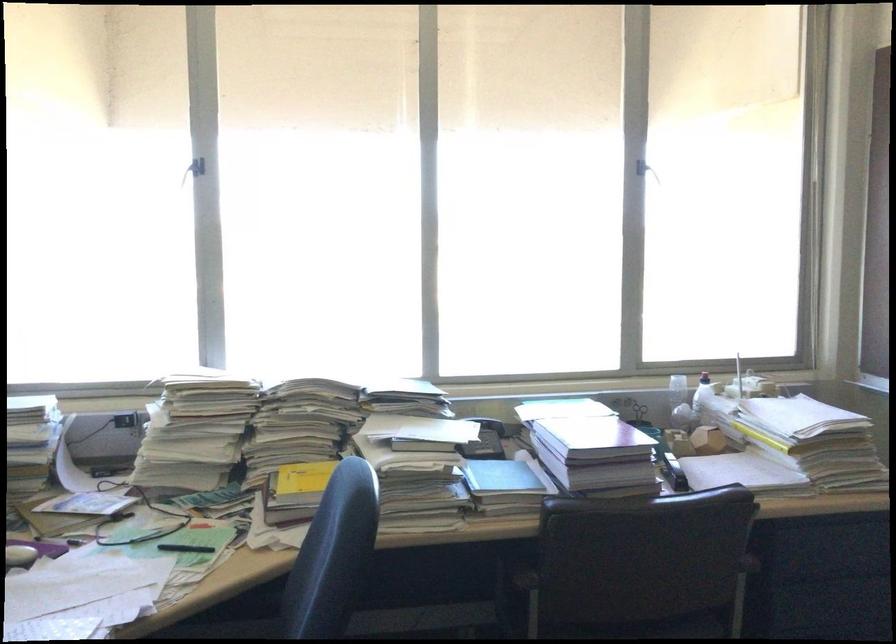
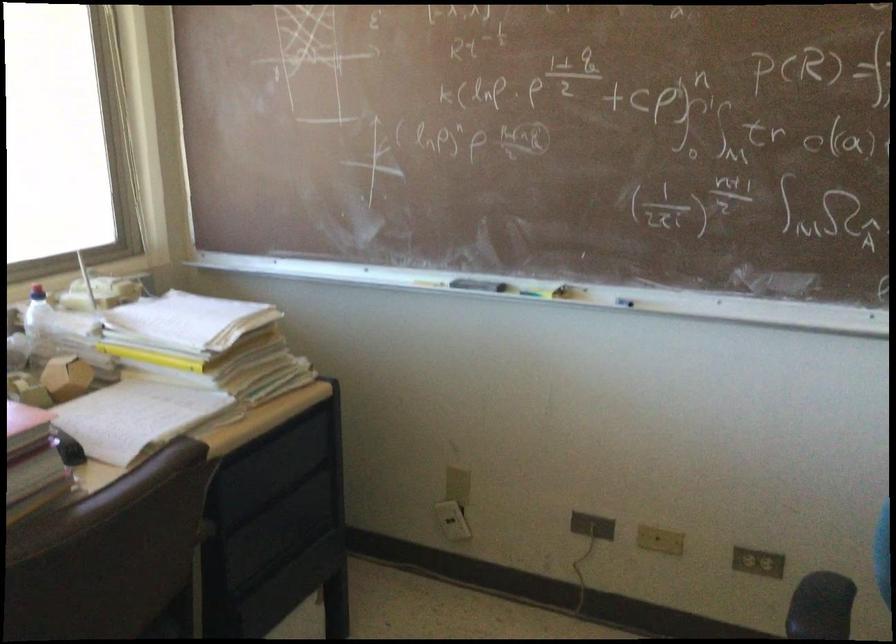
Question: The images are taken continuously from a first-person perspective. In which direction is your viewpoint rotating?

Choices:
 (A) Left
 (B) Right
 (C) Up
 (D) Down

Answer: (B)